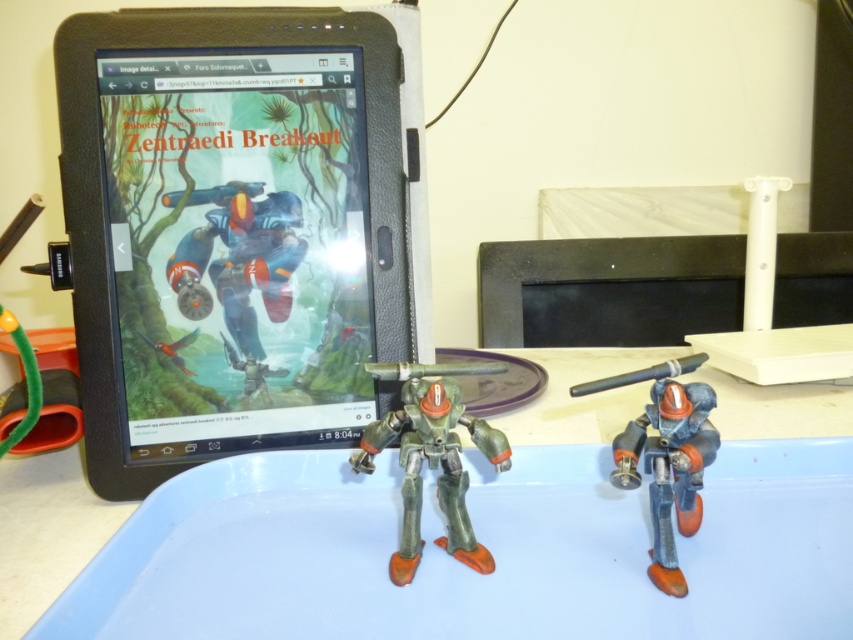
You are organizing a display and need to place a new item between the blue plastic tray at center and the green matte robot at center. According to their positions, which object should the new item be placed closer to?

The new item should be placed closer to the green matte robot at center because the blue plastic tray at center is to the right of the green matte robot at center, meaning the robot is on the left side and the tray is on the right side. Therefore, placing the new item between them would require positioning it closer to the robot to maintain symmetry or balance.

You are organizing a display for a Robotech convention. You have a black matte tablet at upper left and a blue plastic tray at center. Which object takes up more space on the light blue surface?

The blue plastic tray at center takes up more space than the black matte tablet at upper left because the black matte tablet at upper left occupies less space than blue plastic tray at center.